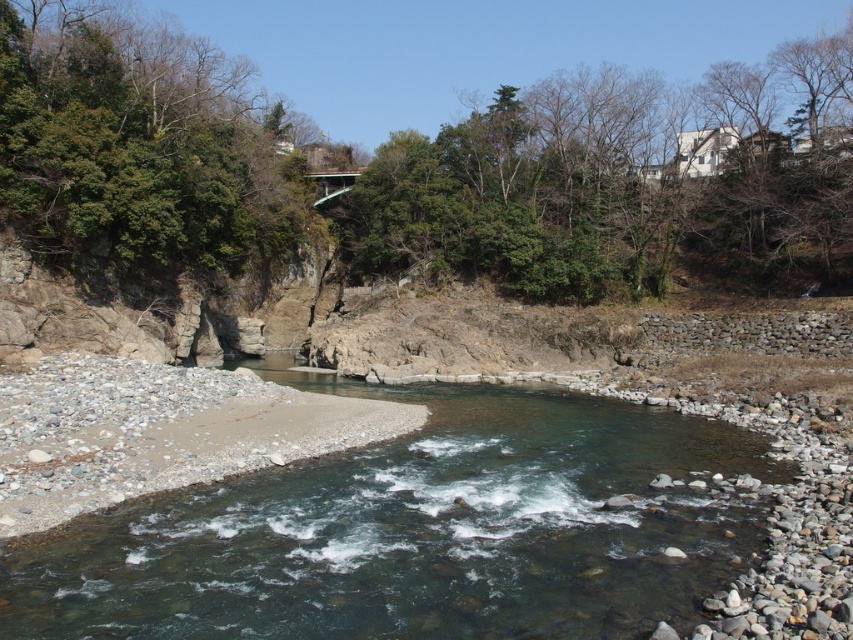
Which is above, clear water at center or green leafy tree at upper left?

Positioned higher is green leafy tree at upper left.

Is point (666, 472) more distant than point (219, 60)?

That is False.

Describe the element at coordinates (415, 531) in the screenshot. I see `clear water at center` at that location.

In order to click on clear water at center in this screenshot , I will do [415, 531].

Does point (167, 595) come behind point (587, 148)?

No, it is in front of (587, 148).

Does point (672, 417) come farther from viewer compared to point (463, 276)?

No, (672, 417) is closer to viewer.

Where is `clear water at center`? The image size is (853, 640). clear water at center is located at coordinates (415, 531).

Which is more to the left, green leafy tree at upper center or green leafy tree at upper left?

From the viewer's perspective, green leafy tree at upper left appears more on the left side.

Measure the distance from green leafy tree at upper center to green leafy tree at upper left.

76.84 feet

Which is in front, point (598, 97) or point (97, 19)?

Point (97, 19)

Find the location of a particular element. The image size is (853, 640). green leafy tree at upper center is located at coordinates (624, 184).